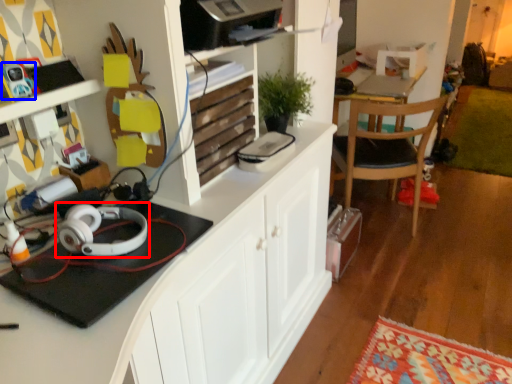
Question: Which of the following is the farthest to the observer, headphones (highlighted by a red box) or toy (highlighted by a blue box)?

Choices:
 (A) headphones
 (B) toy

Answer: (B)